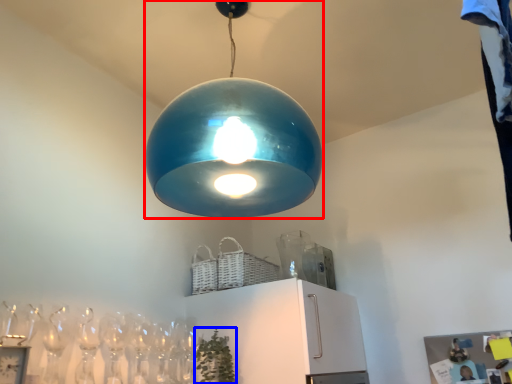
Question: Which object appears farthest to the camera in this image, lamp (highlighted by a red box) or plant (highlighted by a blue box)?

Choices:
 (A) lamp
 (B) plant

Answer: (B)